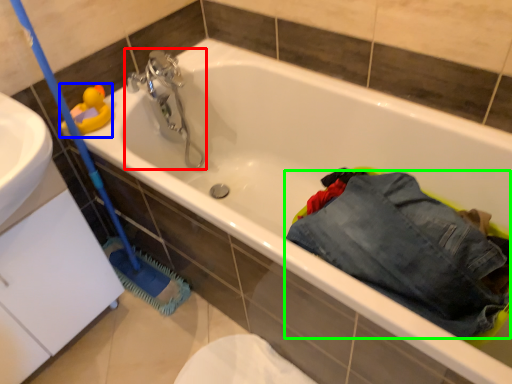
Question: Estimate the real-world distances between objects in this image. Which object is farther from tap (highlighted by a red box), toy (highlighted by a blue box) or trousers (highlighted by a green box)?

Choices:
 (A) toy
 (B) trousers

Answer: (B)